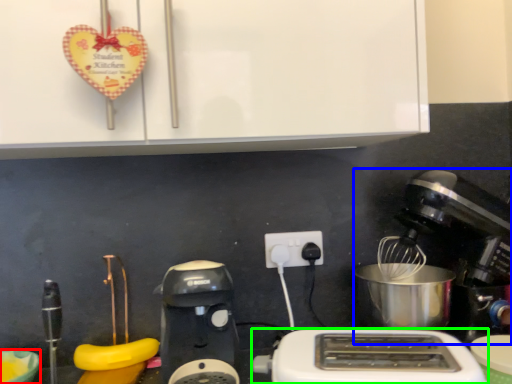
Question: Estimate the real-world distances between objects in this image. Which object is closer to bowl (highlighted by a red box), mixer (highlighted by a blue box) or toaster (highlighted by a green box)?

Choices:
 (A) mixer
 (B) toaster

Answer: (B)